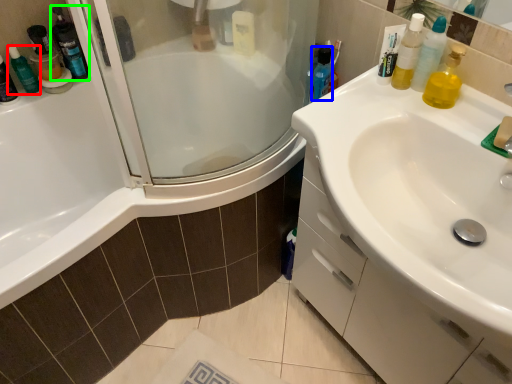
Question: Estimate the real-world distances between objects in this image. Which object is farther from toiletry (highlighted by a red box), mouthwash (highlighted by a blue box) or cleaning product (highlighted by a green box)?

Choices:
 (A) mouthwash
 (B) cleaning product

Answer: (A)